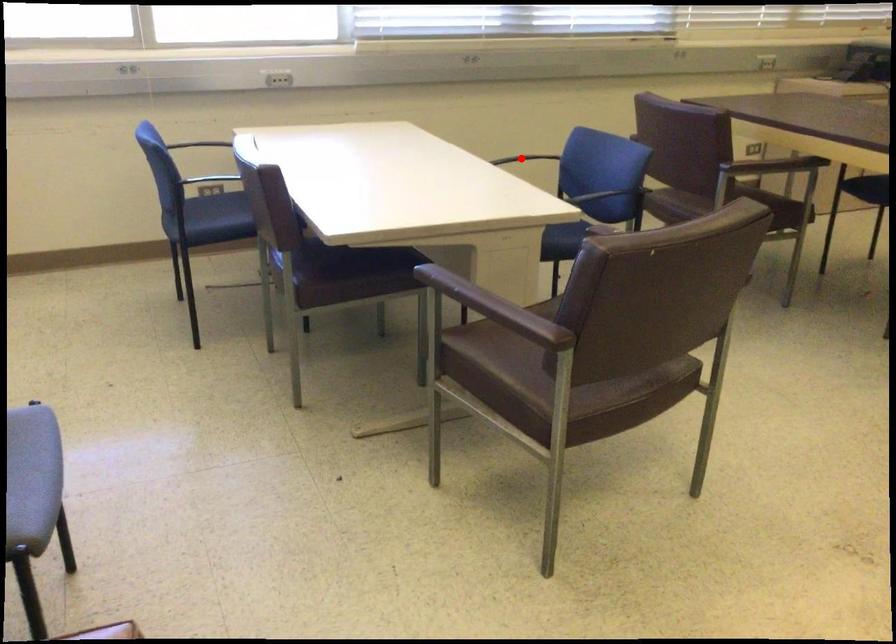
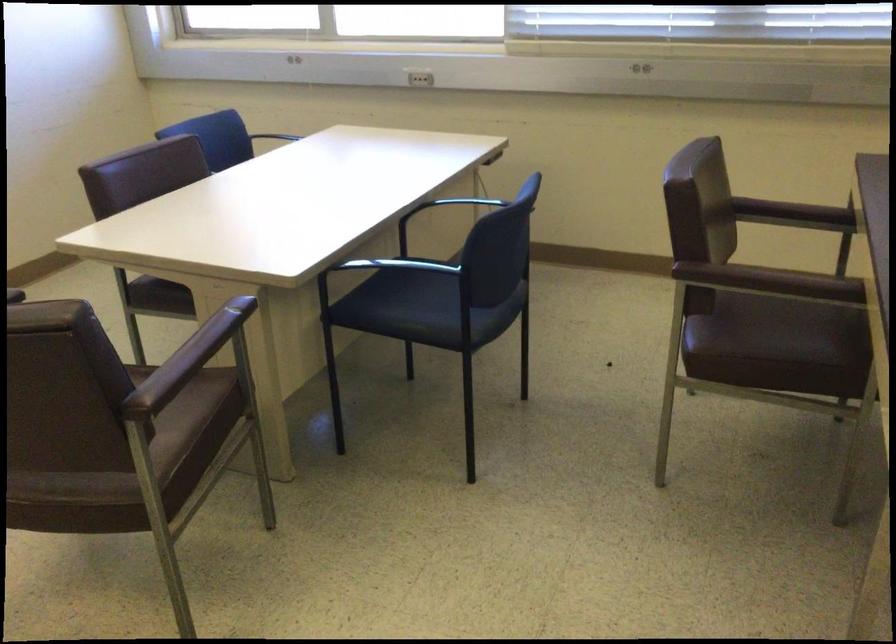
Question: I am providing you with two images of the same scene from different viewpoints. A red point is marked on the first image. Can you still see the location of the red point in image 2?

Choices:
 (A) Yes
 (B) No

Answer: (B)